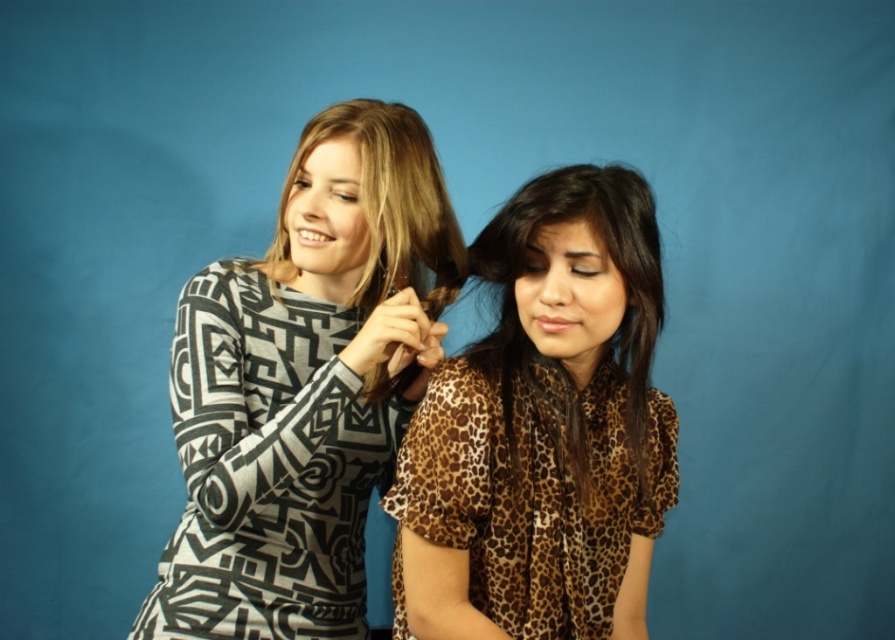
You are standing in front of the image and need to determine the spatial relationship between the black and white geometric print dress at left and the matte black hair at upper center. Which object is located to the left of the other?

The black and white geometric print dress at left is positioned on the left side of matte black hair at upper center, so the dress is to the left of the hair.